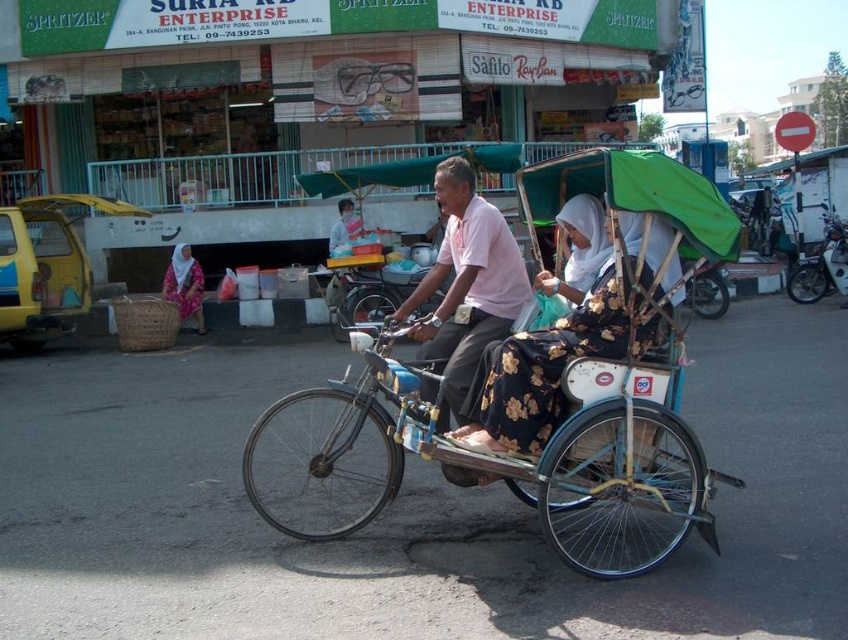
Is point (486, 406) more distant than point (830, 276)?

No, it is not.

Can you confirm if floral fabric dress at center is smaller than white glossy motorbike at right?

Indeed, floral fabric dress at center has a smaller size compared to white glossy motorbike at right.

Is point (480, 444) more distant than point (830, 212)?

No, (480, 444) is in front of (830, 212).

This screenshot has height=640, width=848. Identify the location of floral fabric dress at center. (556, 340).

Who is lower down, blue painted wood tricycle at center or floral fabric headscarf at lower left?

Positioned lower is blue painted wood tricycle at center.

Based on the photo, can you confirm if blue painted wood tricycle at center is bigger than floral fabric headscarf at lower left?

Yes, blue painted wood tricycle at center is bigger than floral fabric headscarf at lower left.

The height and width of the screenshot is (640, 848). Describe the element at coordinates (533, 390) in the screenshot. I see `blue painted wood tricycle at center` at that location.

Locate an element on the screen. The height and width of the screenshot is (640, 848). blue painted wood tricycle at center is located at coordinates (533, 390).

Who is higher up, pink cotton shirt at center or white glossy motorbike at right?

Positioned higher is white glossy motorbike at right.

This screenshot has width=848, height=640. Describe the element at coordinates (466, 284) in the screenshot. I see `pink cotton shirt at center` at that location.

Who is more distant from viewer, (433, 280) or (846, 260)?

The point (846, 260) is more distant.

This screenshot has width=848, height=640. Identify the location of pink cotton shirt at center. (466, 284).